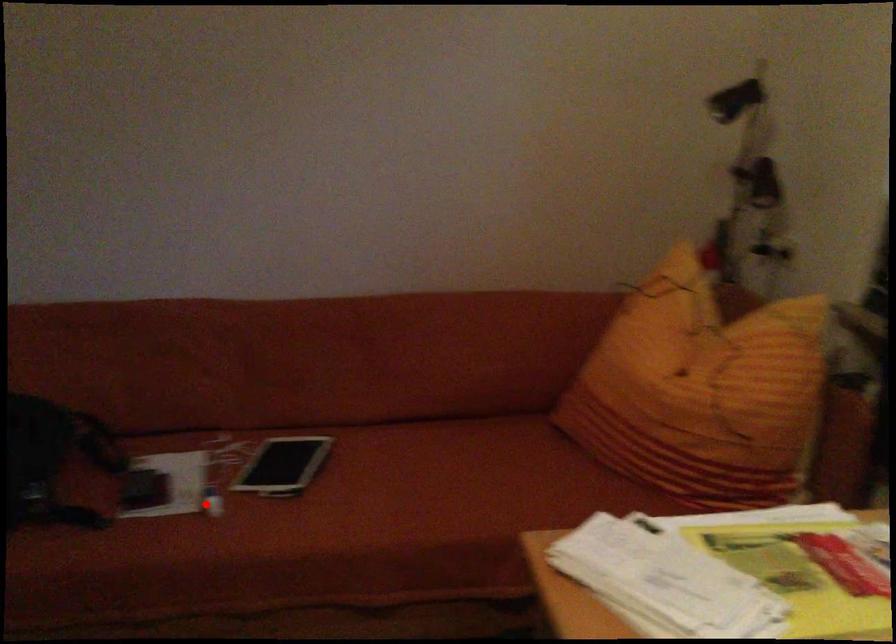
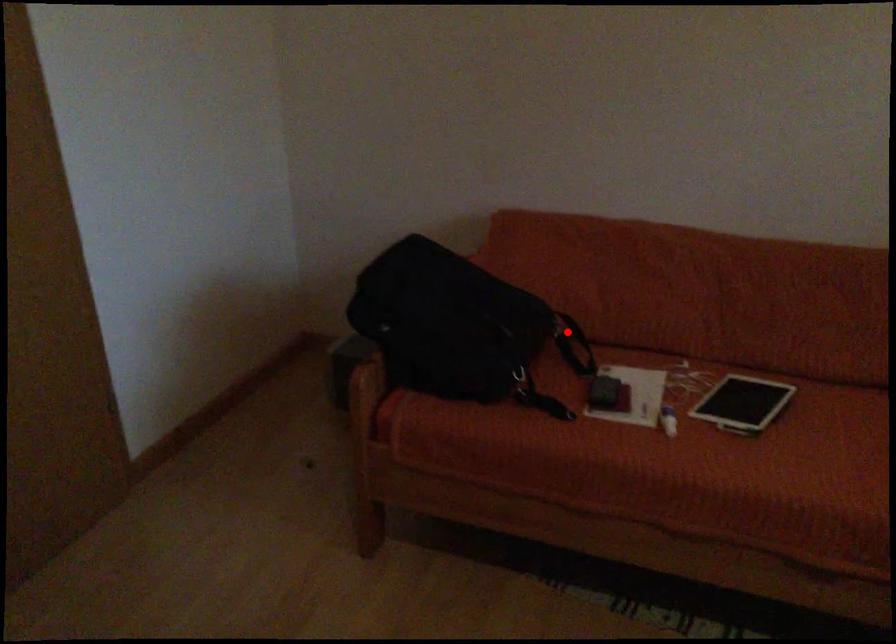
I am providing you with two images of the same scene from different viewpoints. A red point is marked on the first image and another point is marked on the second image. Does the point marked in image1 correspond to the same location as the one in image2?

No